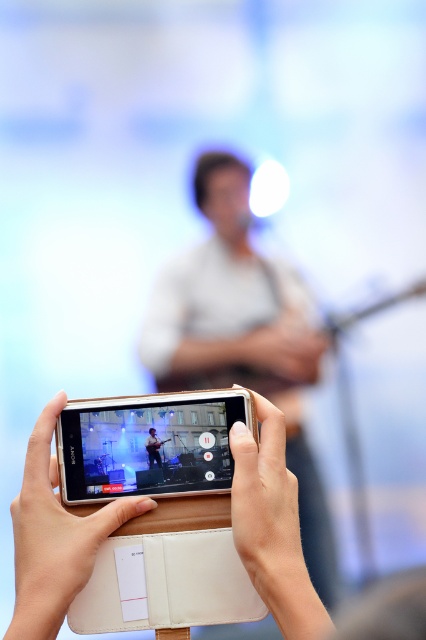
Can you confirm if white matte guitar at center is positioned below white leather wallet at lower center?

No.

Is point (288, 368) positioned before point (98, 512)?

No, (288, 368) is behind (98, 512).

You are a GUI agent. You are given a task and a screenshot of the screen. Output one action in this format:
    pyautogui.click(x=<x>, y=<y>)
    Task: Click on the white matte guitar at center
    This screenshot has width=426, height=640.
    Given the screenshot: What is the action you would take?
    244,337

Based on the photo, which is more to the right, white matte phone at center or white leather wallet at lower center?

Positioned to the right is white matte phone at center.

Can you confirm if white matte phone at center is wider than white leather wallet at lower center?

Yes, white matte phone at center is wider than white leather wallet at lower center.

Which is in front, point (250, 420) or point (39, 563)?

Point (39, 563) is in front.

This screenshot has width=426, height=640. Identify the location of white matte phone at center. (143, 444).

At what (x,y) coordinates should I click in order to perform the action: click on white leather wallet at lower center. Please return your answer as a coordinate pair (x, y). Image resolution: width=426 pixels, height=640 pixels. Looking at the image, I should click on (54, 538).

Between point (57, 593) and point (150, 454), which one is positioned in front?

Point (57, 593) is in front.

The image size is (426, 640). What are the coordinates of `white leather wallet at lower center` in the screenshot? It's located at (54, 538).